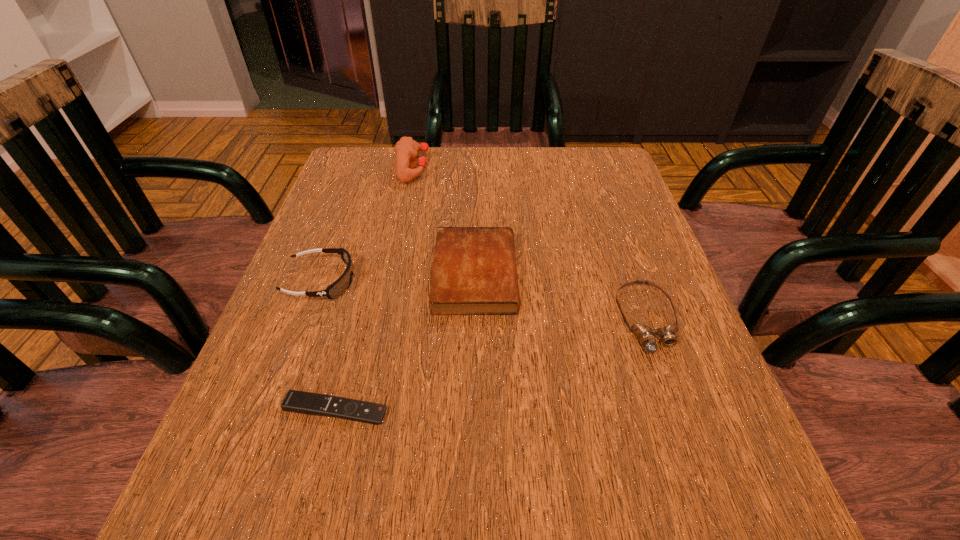
Locate an element on the screen. The height and width of the screenshot is (540, 960). vacant point located between the remote control and the shorter goggles is located at coordinates (492, 364).

You are a GUI agent. You are given a task and a screenshot of the screen. Output one action in this format:
    pyautogui.click(x=<x>, y=<y>)
    Task: Click on the vacant space in between the shortest object and the left goggles
    Image resolution: width=960 pixels, height=540 pixels.
    Given the screenshot: What is the action you would take?
    pyautogui.click(x=328, y=346)

Locate an element on the screen. vacant space that's between the left goggles and the third tallest object is located at coordinates (398, 278).

This screenshot has width=960, height=540. I want to click on vacant point located between the left goggles and the nearest object, so click(x=328, y=346).

This screenshot has width=960, height=540. I want to click on vacant region between the third shortest object and the right goggles, so click(x=562, y=297).

You are a GUI agent. You are given a task and a screenshot of the screen. Output one action in this format:
    pyautogui.click(x=<x>, y=<y>)
    Task: Click on the unoccupied position between the Bible and the taller goggles
    Image resolution: width=960 pixels, height=540 pixels.
    Given the screenshot: What is the action you would take?
    pyautogui.click(x=398, y=278)

You are a GUI agent. You are given a task and a screenshot of the screen. Output one action in this format:
    pyautogui.click(x=<x>, y=<y>)
    Task: Click on the object that is the fourth closest to the shortest object
    The height and width of the screenshot is (540, 960).
    Given the screenshot: What is the action you would take?
    pyautogui.click(x=406, y=149)

You are a GUI agent. You are given a task and a screenshot of the screen. Output one action in this format:
    pyautogui.click(x=<x>, y=<y>)
    Task: Click on the closest object to the Bible
    
    Given the screenshot: What is the action you would take?
    [x=342, y=284]

Identify the location of free space that satisfies the following two spatial constraints: 1. on the back side of the remote control; 2. on the front and sides of the fourth shortest object. (369, 281).

The height and width of the screenshot is (540, 960). I want to click on free space that satisfies the following two spatial constraints: 1. on the front and sides of the left goggles; 2. on the back side of the remote control, so click(274, 410).